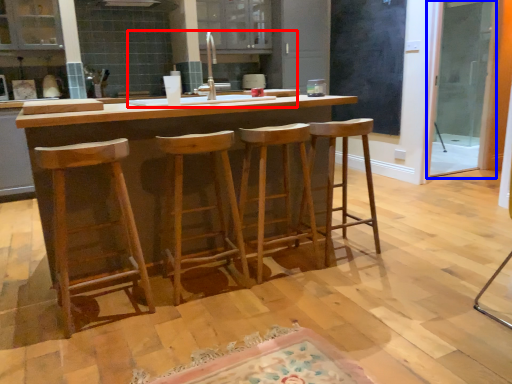
Question: Which object is closer to the camera taking this photo, sink (highlighted by a red box) or screen door (highlighted by a blue box)?

Choices:
 (A) sink
 (B) screen door

Answer: (A)